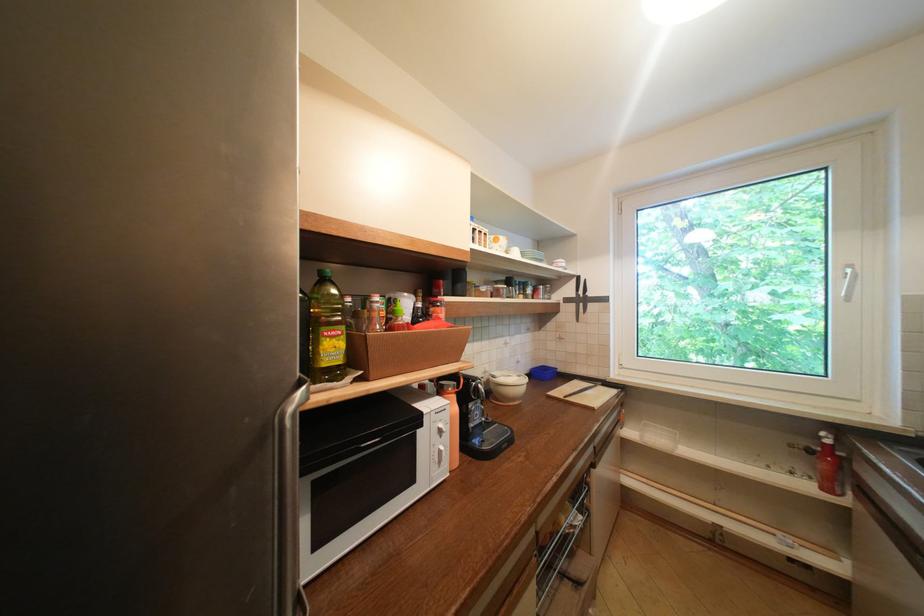
I want to click on metal drawer handle, so click(x=562, y=544).